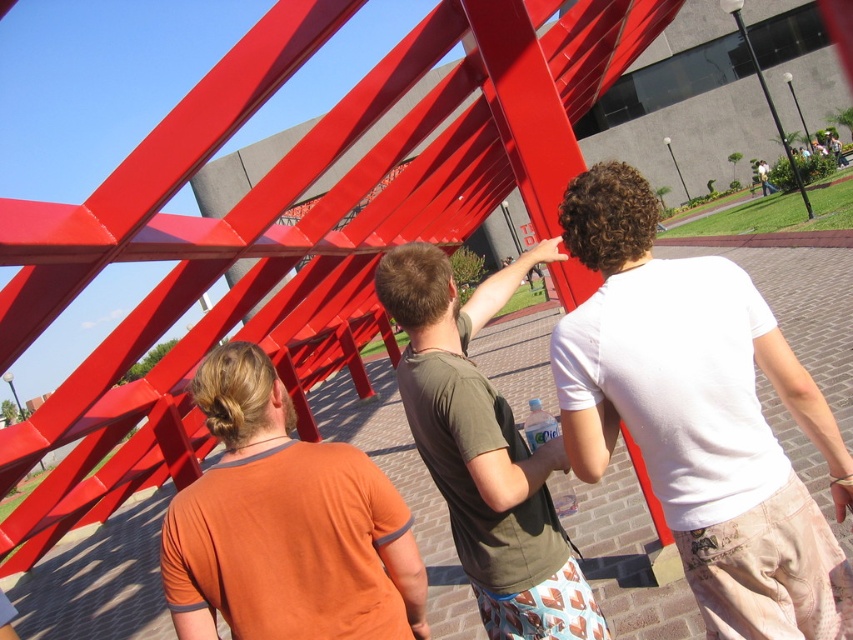
Question: Is the position of orange cotton shirt at center more distant than that of matte green t-shirt at center?

Choices:
 (A) yes
 (B) no

Answer: (B)

Question: Considering the real-world distances, which object is closest to the white cotton shirt at center?

Choices:
 (A) white cotton shirt at upper center
 (B) matte green t-shirt at center
 (C) orange cotton shirt at center

Answer: (B)

Question: In this image, where is white cotton shirt at center located relative to orange cotton shirt at center?

Choices:
 (A) above
 (B) below

Answer: (A)

Question: Where is white cotton shirt at center located in relation to orange cotton shirt at center in the image?

Choices:
 (A) left
 (B) right

Answer: (B)

Question: Among these objects, which one is farthest from the camera?

Choices:
 (A) white cotton shirt at center
 (B) matte green t-shirt at center

Answer: (B)

Question: Which is farther from the white cotton shirt at upper center?

Choices:
 (A) orange cotton shirt at center
 (B) matte green t-shirt at center
 (C) white cotton shirt at center

Answer: (A)